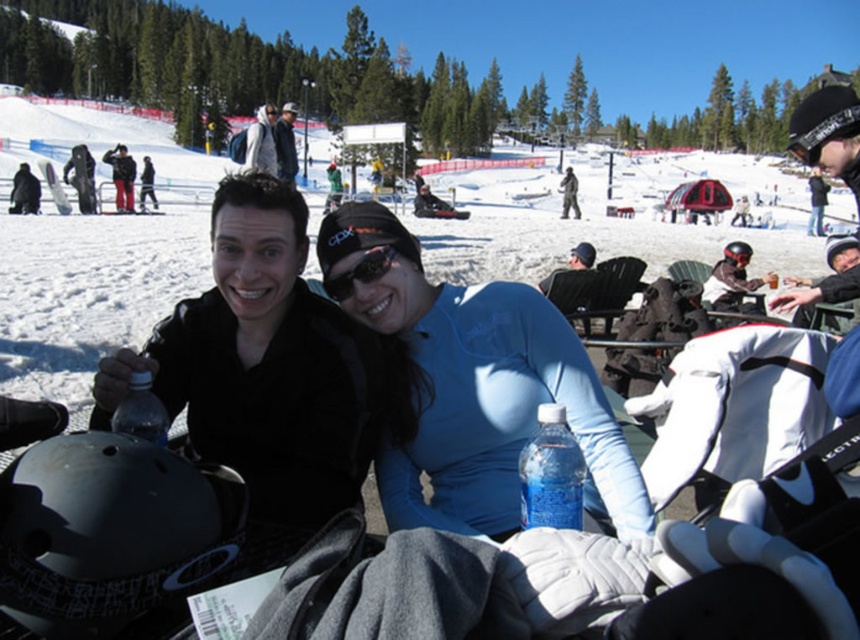
Which of these two, blue plastic bottle at center or transparent plastic bottle at lower left, stands shorter?

With less height is transparent plastic bottle at lower left.

Can you confirm if blue plastic bottle at center is shorter than transparent plastic bottle at lower left?

No, blue plastic bottle at center is not shorter than transparent plastic bottle at lower left.

Find the location of `blue plastic bottle at center`. blue plastic bottle at center is located at coordinates (551, 474).

The image size is (860, 640). What do you see at coordinates (140, 412) in the screenshot? I see `transparent plastic bottle at lower left` at bounding box center [140, 412].

Is transparent plastic bottle at lower left behind dark blue jacket at center?

That is False.

The width and height of the screenshot is (860, 640). What do you see at coordinates (140, 412) in the screenshot?
I see `transparent plastic bottle at lower left` at bounding box center [140, 412].

You are a GUI agent. You are given a task and a screenshot of the screen. Output one action in this format:
    pyautogui.click(x=<x>, y=<y>)
    Task: Click on the transparent plastic bottle at lower left
    
    Given the screenshot: What is the action you would take?
    pyautogui.click(x=140, y=412)

Is sunglasses at center smaller than dark blue jacket at center?

Yes, sunglasses at center is smaller than dark blue jacket at center.

Can you confirm if sunglasses at center is positioned above dark blue jacket at center?

No.

The image size is (860, 640). I want to click on sunglasses at center, so click(359, 273).

Where is `sunglasses at center`? Image resolution: width=860 pixels, height=640 pixels. sunglasses at center is located at coordinates (359, 273).